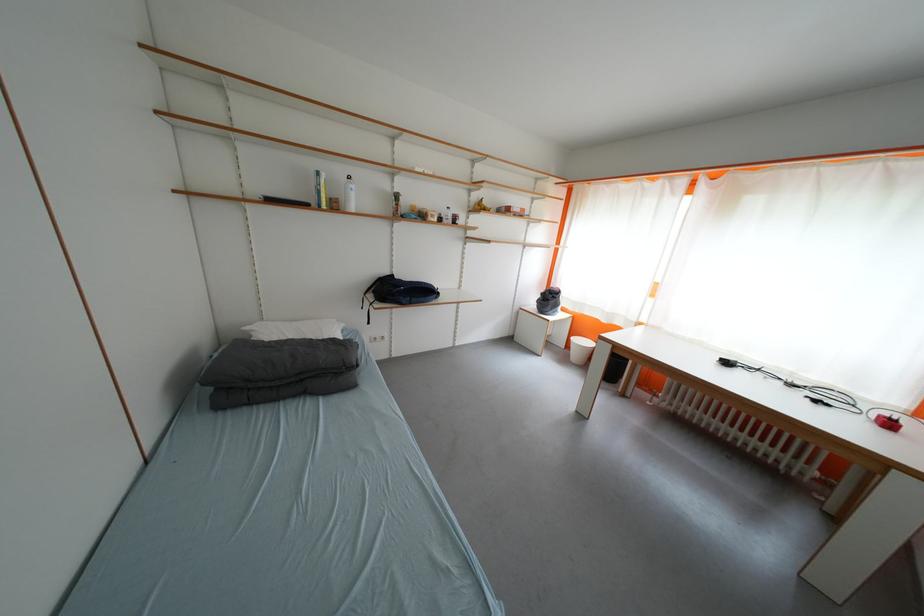
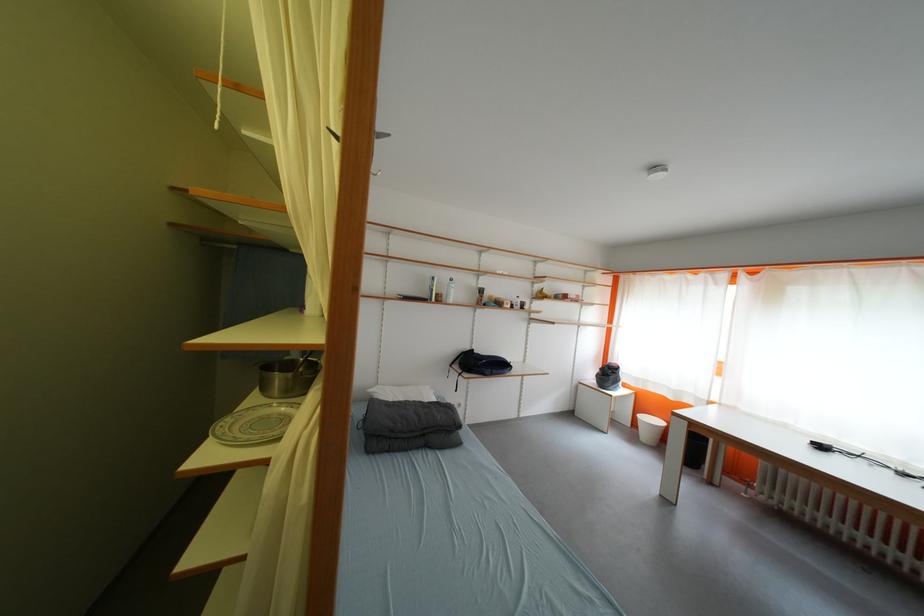
The point at (572, 358) is marked in the first image. Where is the corresponding point in the second image?

(639, 436)